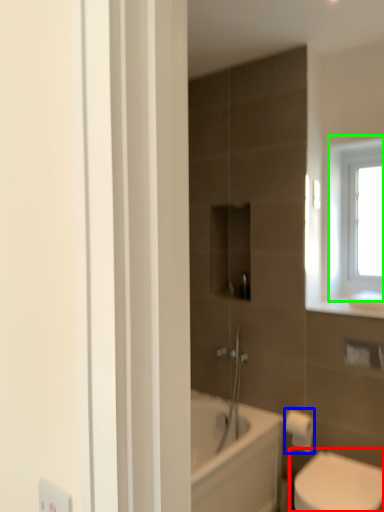
Question: Which is nearer to the toilet (highlighted by a red box)? toilet paper (highlighted by a blue box) or window (highlighted by a green box).

Choices:
 (A) toilet paper
 (B) window

Answer: (A)